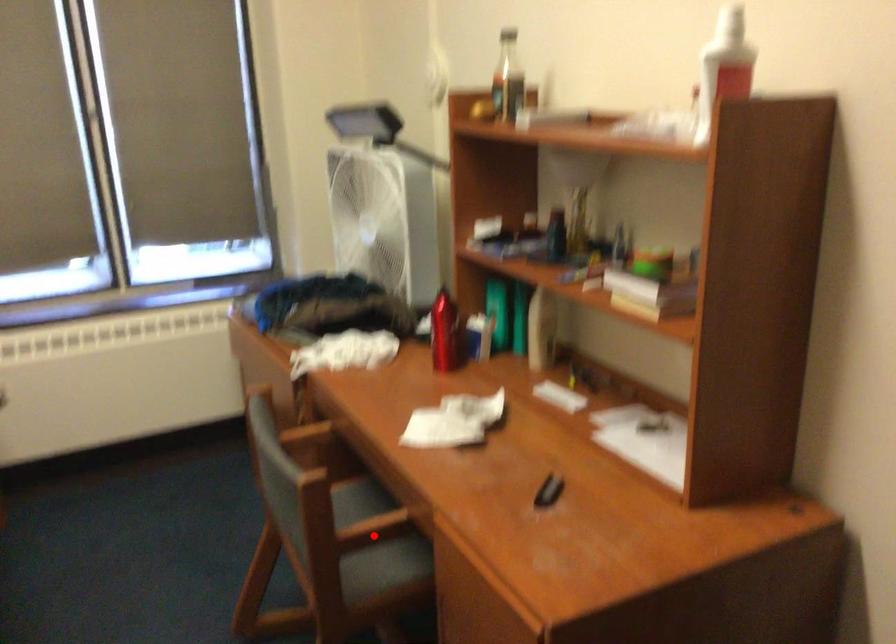
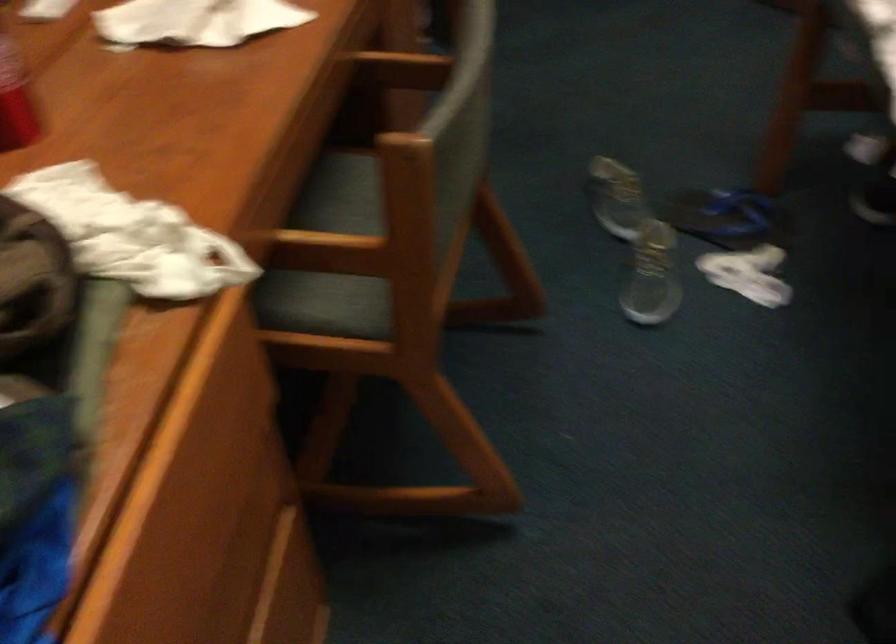
Question: I am providing you with two images of the same scene from different viewpoints. Given a red point in image1, look at the same physical point in image2. Is it:

Choices:
 (A) Closer to the viewpoint
 (B) Farther from the viewpoint

Answer: (A)